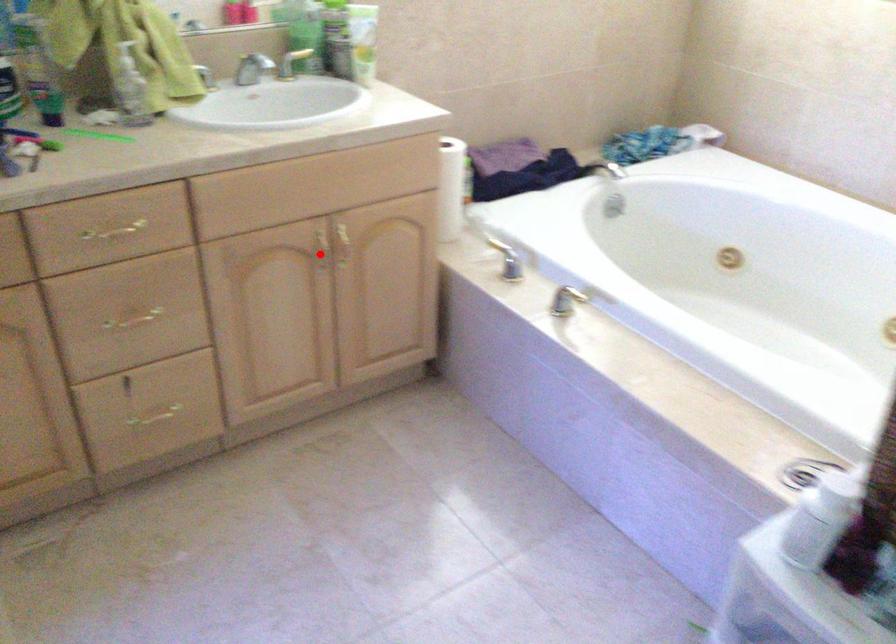
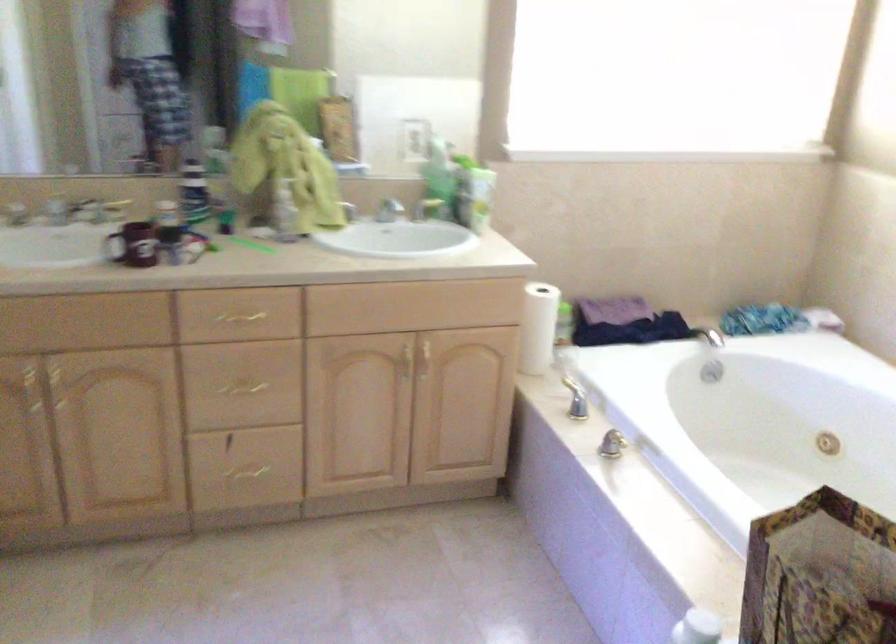
Where in the second image is the point corresponding to the highlighted location from the first image?

(406, 363)